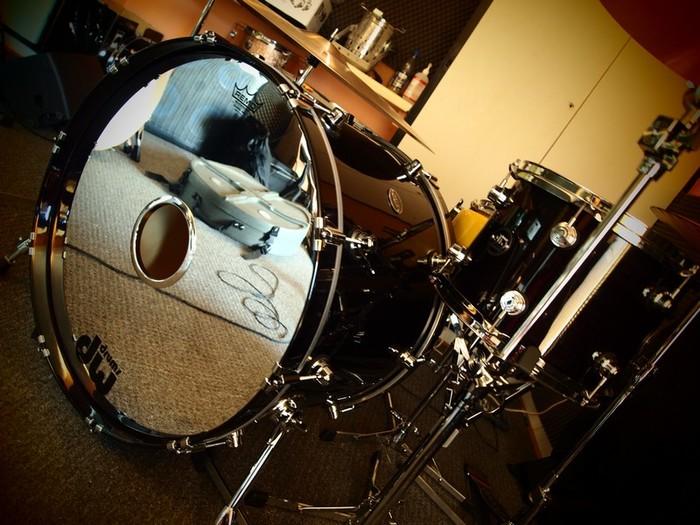
This screenshot has width=700, height=525. In order to click on wall in this screenshot , I will do `click(524, 103)`.